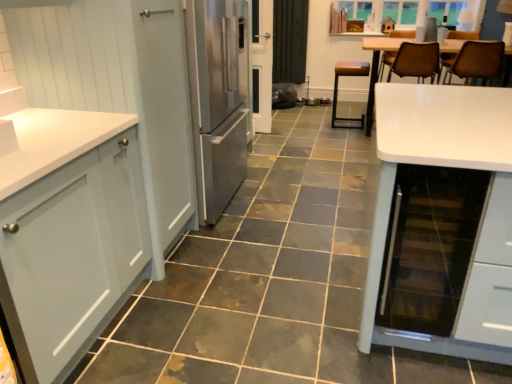
The image size is (512, 384). In order to click on vacant area that is situated to the right of white glossy screen door at center in this screenshot , I will do `click(281, 134)`.